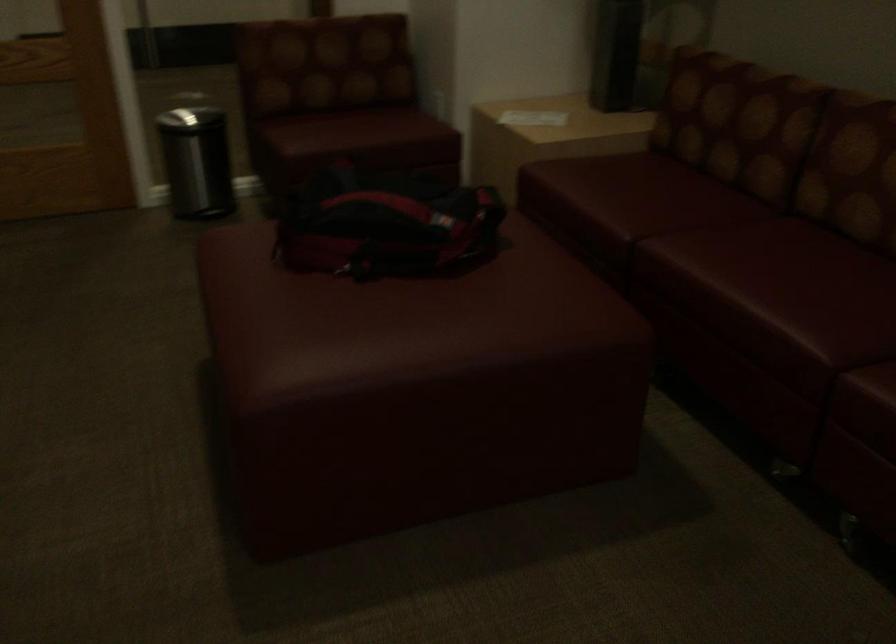
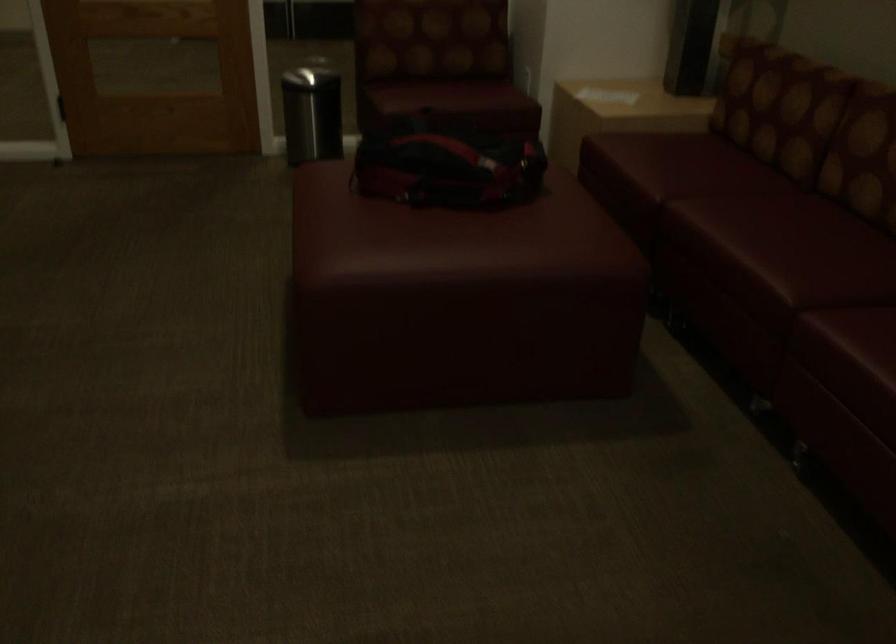
Find the pixel in the second image that matches (418,317) in the first image.

(451, 237)